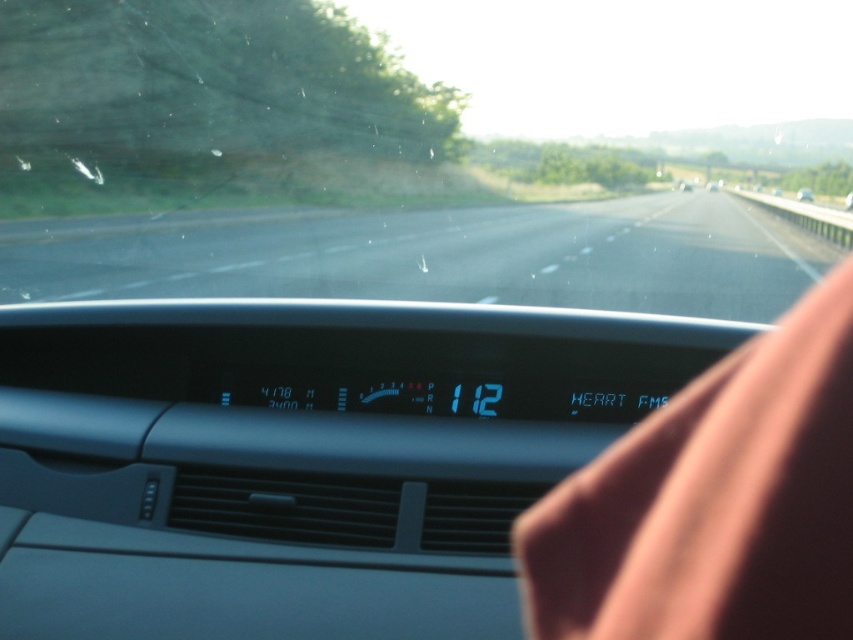
Question: In this image, where is transparent glass windshield at center located relative to black asphalt highway at center?

Choices:
 (A) below
 (B) above

Answer: (B)

Question: Can you confirm if black asphalt highway at center is positioned to the left of metallic silver car at center?

Choices:
 (A) no
 (B) yes

Answer: (B)

Question: Which point is closer to the camera?

Choices:
 (A) transparent glass windshield at center
 (B) metallic silver car at center
 (C) black asphalt highway at center

Answer: (C)

Question: Which point is farther from the camera taking this photo?

Choices:
 (A) (809, 195)
 (B) (142, 198)

Answer: (A)

Question: Can you confirm if black asphalt highway at center is bigger than metallic silver car at center?

Choices:
 (A) no
 (B) yes

Answer: (B)

Question: Which point is farther to the camera?

Choices:
 (A) (798, 198)
 (B) (540, 225)
 (C) (80, 186)

Answer: (A)